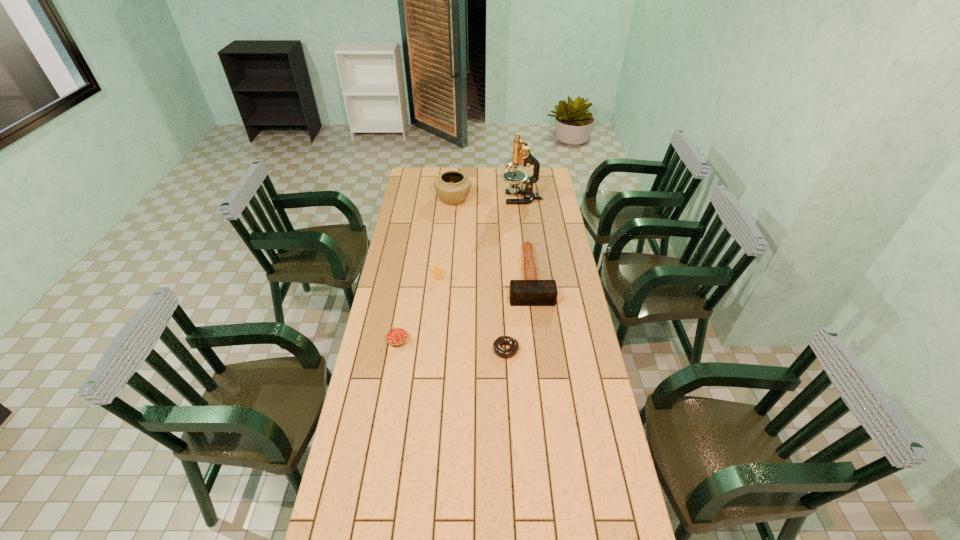
Where is `empty space that is in between the mallet and the leftmost object`? The height and width of the screenshot is (540, 960). empty space that is in between the mallet and the leftmost object is located at coordinates (464, 308).

I want to click on object that is the second closest to the doughnut, so click(x=396, y=337).

Identify which object is the fifth closest to the pottery. Please provide its 2D coordinates. Your answer should be formatted as a tuple, i.e. [(x, y)], where the tuple contains the x and y coordinates of a point satisfying the conditions above.

[(512, 342)]

The image size is (960, 540). What are the coordinates of `vacant space that satisfies the following two spatial constraints: 1. at the eyepiece of the microscope; 2. on the hammer head face of the mallet` in the screenshot? It's located at (532, 276).